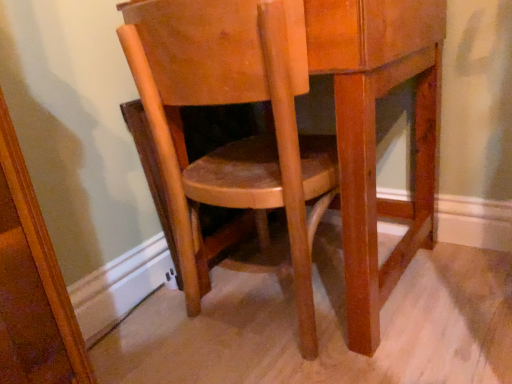
What do you see at coordinates (236, 141) in the screenshot? This screenshot has width=512, height=384. I see `wooden chair at center` at bounding box center [236, 141].

At what (x,y) coordinates should I click in order to perform the action: click on wooden chair at center. Please return your answer as a coordinate pair (x, y). The height and width of the screenshot is (384, 512). Looking at the image, I should click on (236, 141).

Measure the distance between wooden chair at center and camera.

21.33 inches.

The height and width of the screenshot is (384, 512). Identify the location of wooden chair at center. (236, 141).